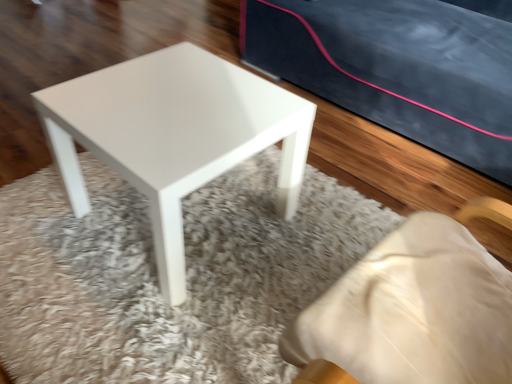
The image size is (512, 384). I want to click on vacant area located to the right-hand side of white glossy stool at center, so click(x=309, y=224).